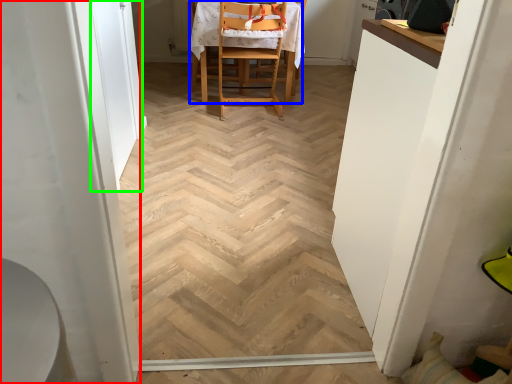
Question: Which is nearer to the screen door (highlighted by a red box)? chair (highlighted by a blue box) or screen door (highlighted by a green box).

Choices:
 (A) chair
 (B) screen door

Answer: (B)